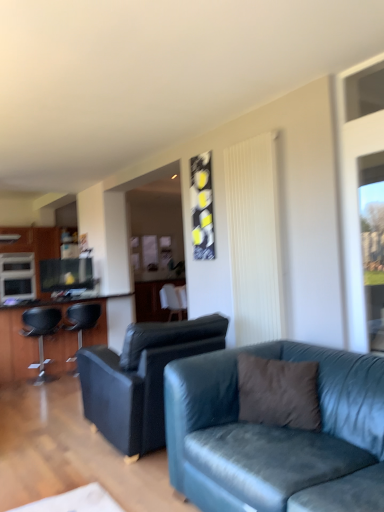
Question: In terms of size, does transparent glass window at right appear bigger or smaller than brown fuzzy pillow at center?

Choices:
 (A) small
 (B) big

Answer: (A)

Question: From the image's perspective, is transparent glass window at right located above or below brown fuzzy pillow at center?

Choices:
 (A) above
 (B) below

Answer: (A)

Question: Which object is the farthest from the transparent glass window at right?

Choices:
 (A) matte black cabinet at left
 (B) matte black bar stool at left, marked as the first chair in a front-to-back arrangement
 (C) leather couch at center, the second studio couch when ordered from front to back
 (D) white textured curtain at center
 (E) satin silver microwave at left

Answer: (A)

Question: Estimate the real-world distances between objects in this image. Which object is farther from the velvet blue couch at center, marked as the 1th studio couch in a front-to-back arrangement?

Choices:
 (A) transparent glass window at right
 (B) matte black bar stool at left, placed as the 3th chair when sorted from right to left
 (C) white textured curtain at center
 (D) matte black entertainment center at left
 (E) brown fuzzy pillow at center

Answer: (D)